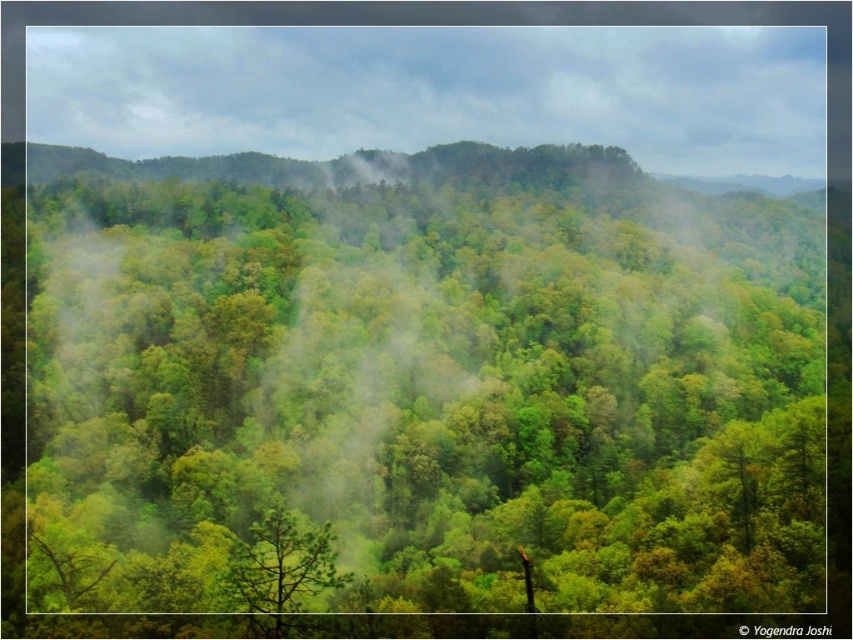
You are a hiker trying to navigate through the forest. You see a green leafy tree at center and a green misty forest at upper center. Which object is bigger in size?

The green leafy tree at center is larger in size compared to the green misty forest at upper center.

You are an environmental scientist assessing the forest canopy. You observe two trees at the center of the image, a green leafy tree at center and a green matte tree at center. Which tree has a greater height?

The green leafy tree at center is taller than the green matte tree at center.